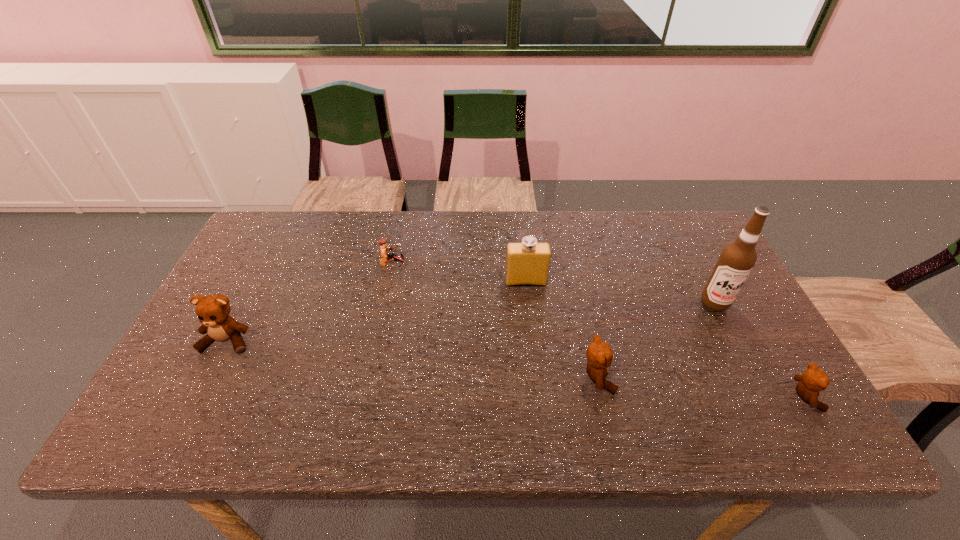
This screenshot has height=540, width=960. What are the coordinates of `the fifth object from left to right` in the screenshot? It's located at (737, 259).

The image size is (960, 540). I want to click on alcohol, so click(737, 259).

I want to click on blank space located 0.060m on the front-facing side of the tallest teddy bear, so click(x=209, y=376).

This screenshot has width=960, height=540. Find the location of `vacant position located 0.220m on the front-facing side of the fourth object from left to right`. vacant position located 0.220m on the front-facing side of the fourth object from left to right is located at coordinates (706, 377).

The width and height of the screenshot is (960, 540). In order to click on vacant space located on the front-facing side of the third object from left to right in this screenshot , I will do `click(529, 314)`.

You are a GUI agent. You are given a task and a screenshot of the screen. Output one action in this format:
    pyautogui.click(x=<x>, y=<y>)
    Task: Click on the blank space located holding a crossbow in the hands of the farthest object
    The height and width of the screenshot is (540, 960).
    Given the screenshot: What is the action you would take?
    pyautogui.click(x=459, y=265)

The image size is (960, 540). What are the coordinates of `vacant region located 0.260m on the label of the tallest object` in the screenshot? It's located at (764, 399).

Where is `object that is at the far edge`? object that is at the far edge is located at coordinates (385, 256).

Identify the location of object present at the left edge. The height and width of the screenshot is (540, 960). (213, 311).

At what (x,y) coordinates should I click in order to perform the action: click on teddy bear located at the right edge. Please return your answer as a coordinate pair (x, y). This screenshot has width=960, height=540. Looking at the image, I should click on (813, 380).